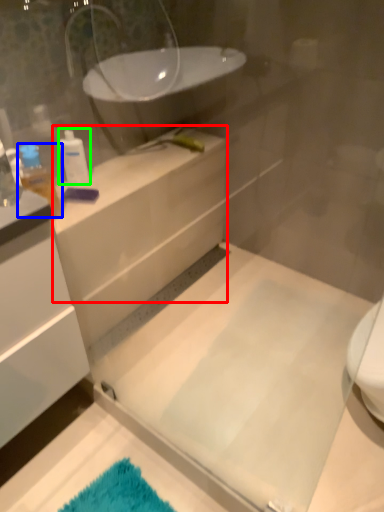
Question: Based on their relative distances, which object is farther from counter top (highlighted by a red box)? Choose from toiletry (highlighted by a blue box) and toiletry (highlighted by a green box).

Choices:
 (A) toiletry
 (B) toiletry

Answer: (A)